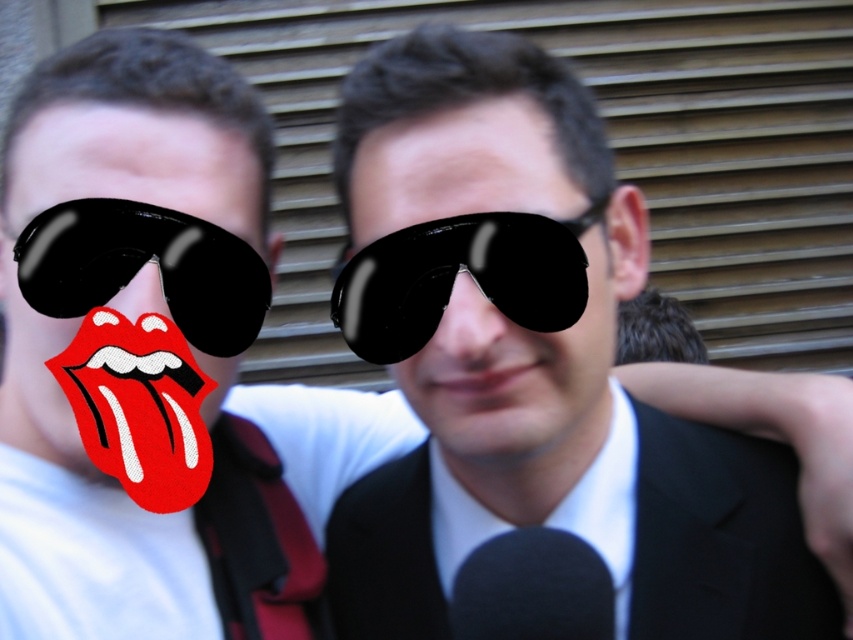
You are a photographer trying to focus on the black glossy tongue at center in the image. However, the black glossy sunglasses at center is blocking your view. Can you move the sunglasses to the side to get a clear shot of the tongue?

The black glossy sunglasses at center is closer to the viewer than the black glossy tongue at center, so moving the sunglasses would allow you to see the tongue behind it.

Based on the photo, you are a photographer trying to capture a candid shot of the person on the right. You are currently positioned at point point (x=624, y=232). To ensure the shot is clear, you need to be at least 36 inches away from the subject. Is your current position sufficient?

The distance between point (x=624, y=232) and the camera is 34.03 inches. Since this is less than the required 36 inches, the current position is not sufficient to ensure a clear shot.